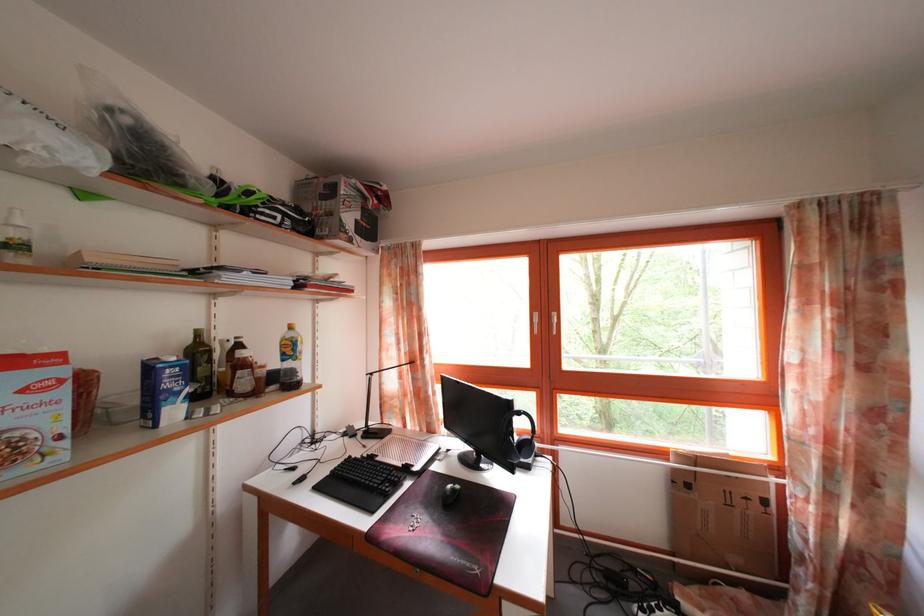
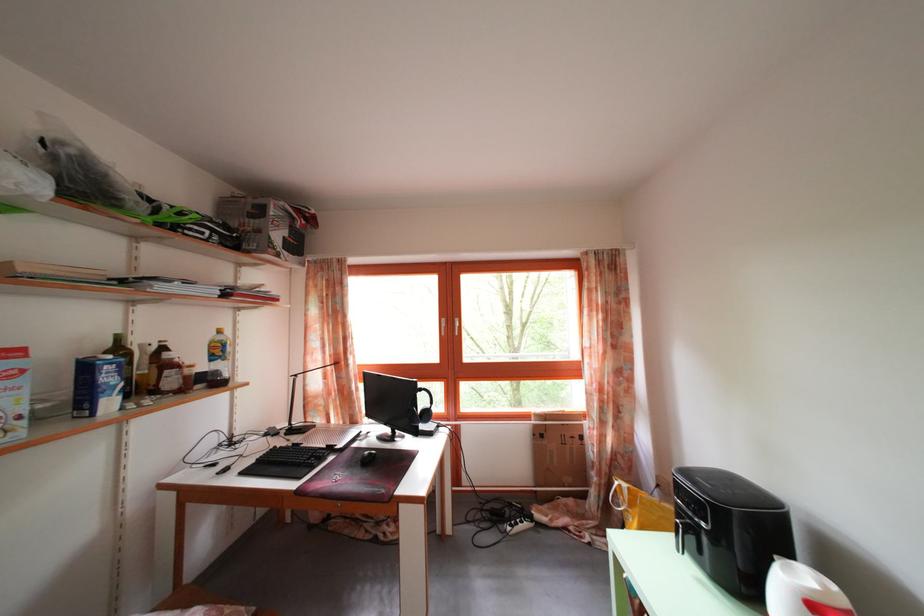
Where in the second image is the point corresponding to point 205,342 from the first image?

(126, 346)